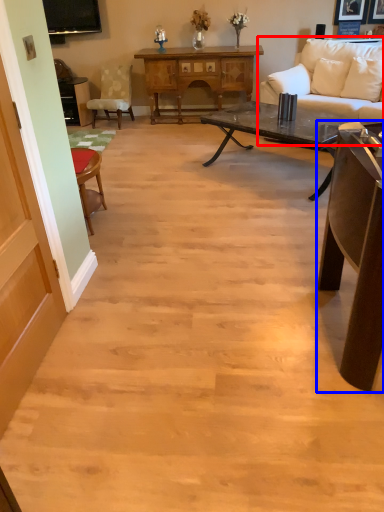
Question: Among these objects, which one is farthest to the camera, studio couch (highlighted by a red box) or table (highlighted by a blue box)?

Choices:
 (A) studio couch
 (B) table

Answer: (A)